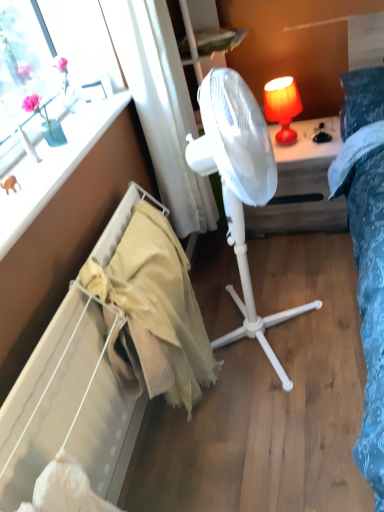
At what (x,y) coordinates should I click in order to perform the action: click on vacant area in front of white plastic fan at center. Please return your answer as a coordinate pair (x, y). The width and height of the screenshot is (384, 512). Looking at the image, I should click on (286, 431).